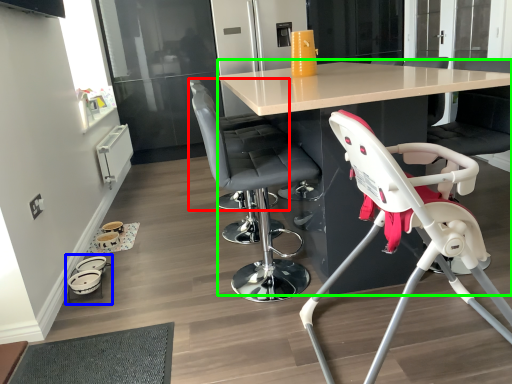
Question: Which object is positioned farthest from chair (highlighted by a red box)? Select from baby carriage (highlighted by a blue box) and table (highlighted by a green box).

Choices:
 (A) baby carriage
 (B) table

Answer: (A)